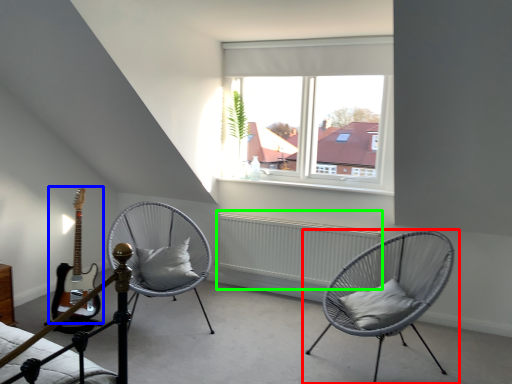
Question: Which object is the closest to the chair (highlighted by a red box)? Choose among these: guitar (highlighted by a blue box) or radiator (highlighted by a green box).

Choices:
 (A) guitar
 (B) radiator

Answer: (B)